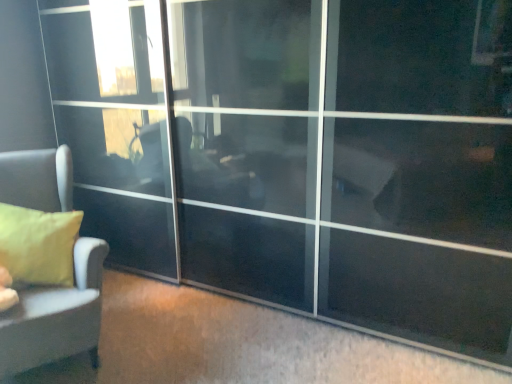
Question: From a real-world perspective, is matte gray sofa at left positioned under transparent glass screen door at center based on gravity?

Choices:
 (A) yes
 (B) no

Answer: (A)

Question: Does matte gray sofa at left appear on the left side of transparent glass screen door at center?

Choices:
 (A) no
 (B) yes

Answer: (B)

Question: From the image's perspective, is matte gray sofa at left located above transparent glass screen door at center?

Choices:
 (A) yes
 (B) no

Answer: (B)

Question: Does matte gray sofa at left contain transparent glass screen door at center?

Choices:
 (A) no
 (B) yes

Answer: (A)

Question: Considering the relative sizes of matte gray sofa at left and transparent glass screen door at center in the image provided, is matte gray sofa at left bigger than transparent glass screen door at center?

Choices:
 (A) yes
 (B) no

Answer: (B)

Question: Is matte yellow pillow at left wider or thinner than transparent glass screen door at center?

Choices:
 (A) thin
 (B) wide

Answer: (A)

Question: Relative to transparent glass screen door at center, is matte yellow pillow at left in front or behind?

Choices:
 (A) behind
 (B) front

Answer: (A)

Question: From the image's perspective, is matte yellow pillow at left positioned above or below transparent glass screen door at center?

Choices:
 (A) above
 (B) below

Answer: (B)

Question: Is matte yellow pillow at left taller or shorter than transparent glass screen door at center?

Choices:
 (A) short
 (B) tall

Answer: (A)

Question: Based on their positions, is transparent glass screen door at center located to the left or right of matte gray sofa at left?

Choices:
 (A) left
 (B) right

Answer: (B)

Question: Relative to matte gray sofa at left, is transparent glass screen door at center in front or behind?

Choices:
 (A) front
 (B) behind

Answer: (A)

Question: From the image's perspective, is transparent glass screen door at center located above or below matte gray sofa at left?

Choices:
 (A) above
 (B) below

Answer: (A)

Question: From a real-world perspective, is transparent glass screen door at center above or below matte gray sofa at left?

Choices:
 (A) above
 (B) below

Answer: (A)

Question: From a real-world perspective, relative to matte yellow pillow at left, is transparent glass screen door at center vertically above or below?

Choices:
 (A) above
 (B) below

Answer: (A)

Question: In terms of height, does transparent glass screen door at center look taller or shorter compared to matte yellow pillow at left?

Choices:
 (A) tall
 (B) short

Answer: (A)